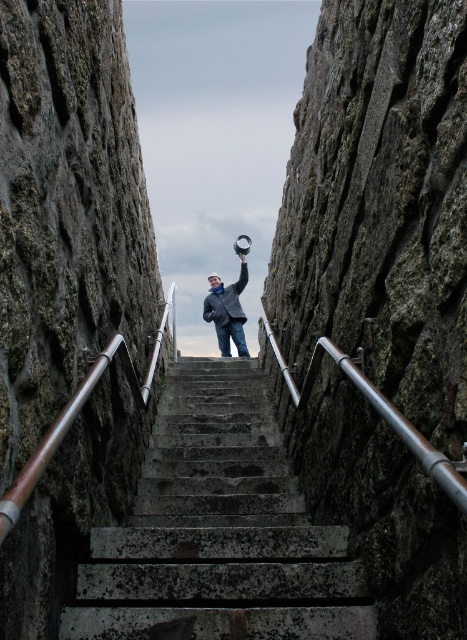
You are standing at the bottom of the staircase and want to reach the top. You notice two points marked on the wall. The first point is at coordinate point (313, 577) and the second is at point (220, 320). Which point should you aim for if you want to reach the nearest one first while climbing?

Point (313, 577) is closer to the viewer than point (220, 320), so you should aim for point (313, 577) first.